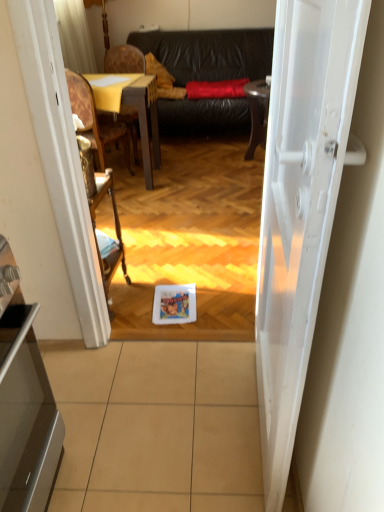
Question: Is white glossy door at center wider than wooden polished chair at left, arranged as the first chair when viewed from the front?

Choices:
 (A) yes
 (B) no

Answer: (B)

Question: From the image's perspective, does white glossy door at center appear lower than wooden polished chair at left, which is counted as the second chair, starting from the back?

Choices:
 (A) yes
 (B) no

Answer: (A)

Question: Is white glossy door at center further to the viewer compared to wooden polished chair at left, arranged as the first chair when viewed from the front?

Choices:
 (A) no
 (B) yes

Answer: (A)

Question: Is wooden polished chair at left, which is counted as the second chair, starting from the back, at the back of white glossy door at center?

Choices:
 (A) yes
 (B) no

Answer: (B)

Question: From a real-world perspective, is white glossy door at center physically above wooden polished chair at left, which is counted as the second chair, starting from the back?

Choices:
 (A) no
 (B) yes

Answer: (B)

Question: Can you confirm if white glossy door at center is shorter than wooden polished chair at left, which is counted as the second chair, starting from the back?

Choices:
 (A) no
 (B) yes

Answer: (A)

Question: From a real-world perspective, is wooden polished chair at left, which is counted as the second chair, starting from the back, beneath wooden textured chair at left, the 2th chair when ordered from front to back?

Choices:
 (A) no
 (B) yes

Answer: (A)

Question: Can you confirm if wooden polished chair at left, which is counted as the second chair, starting from the back, is taller than wooden textured chair at left, the 2th chair when ordered from front to back?

Choices:
 (A) no
 (B) yes

Answer: (A)

Question: Is wooden polished chair at left, arranged as the first chair when viewed from the front, turned away from wooden textured chair at left, the 2th chair when ordered from front to back?

Choices:
 (A) no
 (B) yes

Answer: (A)

Question: Considering the relative positions of wooden polished chair at left, arranged as the first chair when viewed from the front, and wooden textured chair at left, which is the first chair in back-to-front order, in the image provided, is wooden polished chair at left, arranged as the first chair when viewed from the front, to the right of wooden textured chair at left, which is the first chair in back-to-front order, from the viewer's perspective?

Choices:
 (A) yes
 (B) no

Answer: (B)

Question: Can you confirm if wooden polished chair at left, arranged as the first chair when viewed from the front, is thinner than wooden textured chair at left, which is the first chair in back-to-front order?

Choices:
 (A) yes
 (B) no

Answer: (B)

Question: From the image's perspective, is wooden polished chair at left, which is counted as the second chair, starting from the back, located above wooden textured chair at left, the 2th chair when ordered from front to back?

Choices:
 (A) yes
 (B) no

Answer: (B)

Question: Considering the relative sizes of wooden armchair at center and beige tile at center in the image provided, is wooden armchair at center smaller than beige tile at center?

Choices:
 (A) yes
 (B) no

Answer: (B)